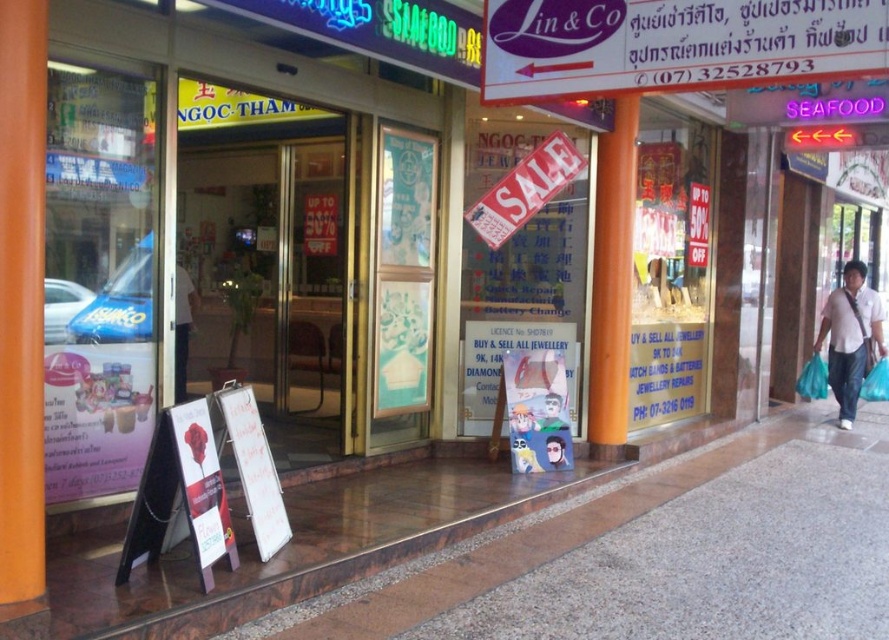
Question: Can you confirm if brown polished stone pavement at lower center is wider than metallic silver helmet at center?

Choices:
 (A) yes
 (B) no

Answer: (A)

Question: Does white cotton shirt at right appear on the right side of metallic silver helmet at center?

Choices:
 (A) yes
 (B) no

Answer: (A)

Question: Among these points, which one is farthest from the camera?

Choices:
 (A) (830, 340)
 (B) (607, 189)

Answer: (A)

Question: Can you confirm if brown polished stone pavement at lower center is bigger than orange matte pillar at center?

Choices:
 (A) yes
 (B) no

Answer: (A)

Question: Which object appears farthest from the camera in this image?

Choices:
 (A) white cotton shirt at right
 (B) orange matte pillar at center
 (C) metallic silver helmet at center

Answer: (A)

Question: Which object is positioned farthest from the white cotton shirt at right?

Choices:
 (A) metallic silver helmet at center
 (B) brown polished stone pavement at lower center
 (C) orange matte pillar at center

Answer: (A)